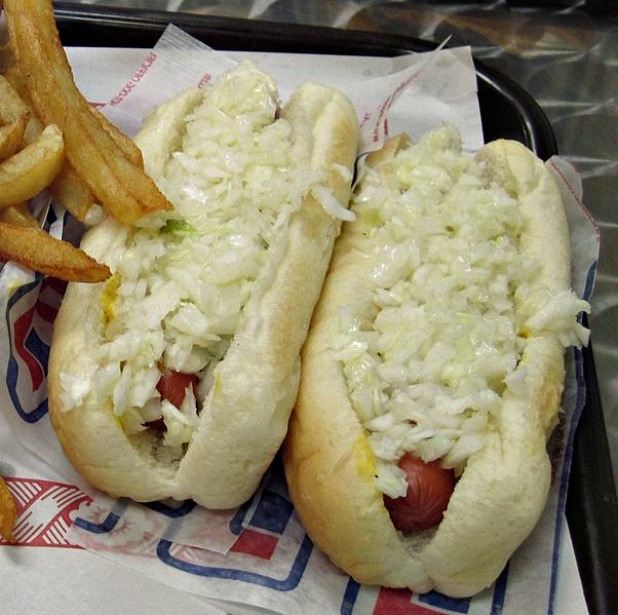
The image size is (618, 615). I want to click on empty space on table behind tray, so click(x=581, y=48).